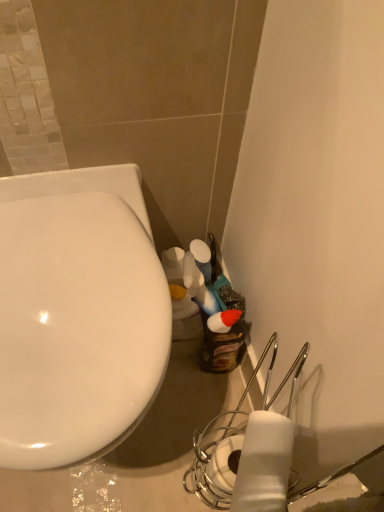
Question: From the image's perspective, is white glossy toilet at left located above white matte toilet paper at lower right?

Choices:
 (A) no
 (B) yes

Answer: (B)

Question: Is white glossy toilet at left wider than white matte toilet paper at lower right?

Choices:
 (A) yes
 (B) no

Answer: (A)

Question: Considering the relative sizes of white glossy toilet at left and white matte toilet paper at lower right in the image provided, is white glossy toilet at left thinner than white matte toilet paper at lower right?

Choices:
 (A) no
 (B) yes

Answer: (A)

Question: Is white glossy toilet at left smaller than white matte toilet paper at lower right?

Choices:
 (A) no
 (B) yes

Answer: (A)

Question: Can you confirm if white glossy toilet at left is taller than white matte toilet paper at lower right?

Choices:
 (A) yes
 (B) no

Answer: (A)

Question: Is white glossy toilet at left positioned far away from white matte toilet paper at lower right?

Choices:
 (A) no
 (B) yes

Answer: (A)

Question: Is white matte toilet paper at lower right wider than white glossy toilet at left?

Choices:
 (A) no
 (B) yes

Answer: (A)

Question: Is the depth of white matte toilet paper at lower right greater than that of white glossy toilet at left?

Choices:
 (A) no
 (B) yes

Answer: (A)

Question: Can you confirm if white matte toilet paper at lower right is positioned to the left of white glossy toilet at left?

Choices:
 (A) no
 (B) yes

Answer: (A)

Question: Can white glossy toilet at left be found inside white matte toilet paper at lower right?

Choices:
 (A) yes
 (B) no

Answer: (B)

Question: From a real-world perspective, is white matte toilet paper at lower right physically below white glossy toilet at left?

Choices:
 (A) no
 (B) yes

Answer: (A)

Question: Is white matte toilet paper at lower right not close to white glossy toilet at left?

Choices:
 (A) yes
 (B) no

Answer: (B)

Question: Considering the positions of point (283, 449) and point (13, 270), is point (283, 449) closer or farther from the camera than point (13, 270)?

Choices:
 (A) closer
 (B) farther

Answer: (A)